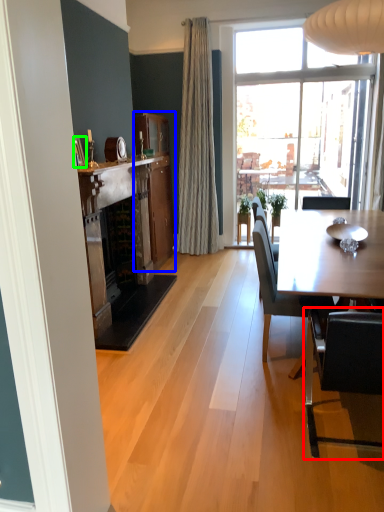
Question: Which is farther away from chair (highlighted by a red box)? cabinetry (highlighted by a blue box) or picture frame (highlighted by a green box)?

Choices:
 (A) cabinetry
 (B) picture frame

Answer: (A)